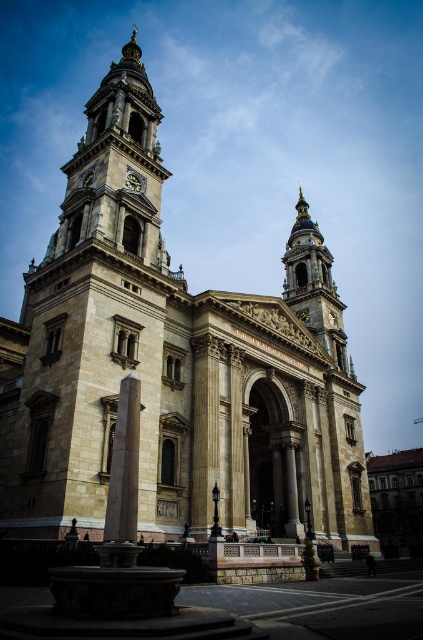
You are an architect examining the cathedral. You notice the golden stone tower at center and the smooth stone column at center. Which one is positioned higher in the image?

The golden stone tower at center is located above the smooth stone column at center, so it is positioned higher in the image.

You are standing in front of the cathedral and notice two points marked on the facade. The first point is at coordinates point (293,291) and the second is at point (128,397). Which point is closer to your eyes?

Point (128,397) is closer to your eyes because it is less further to the camera than point (293,291).

You are an architect visiting the cathedral and want to compare the two central structures. Which one is larger in size between the golden stone tower at center and the smooth stone column at center?

The golden stone tower at center is bigger than the smooth stone column at center.